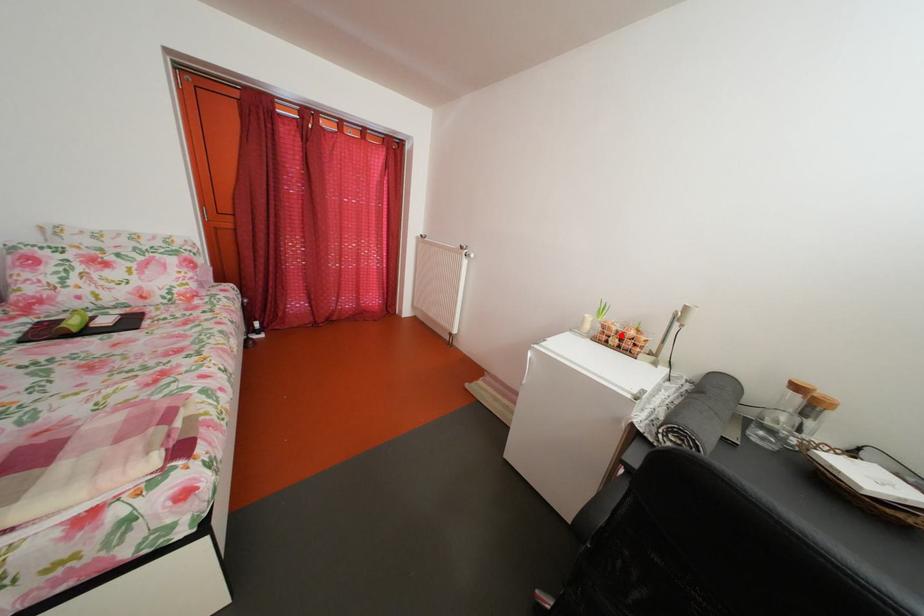
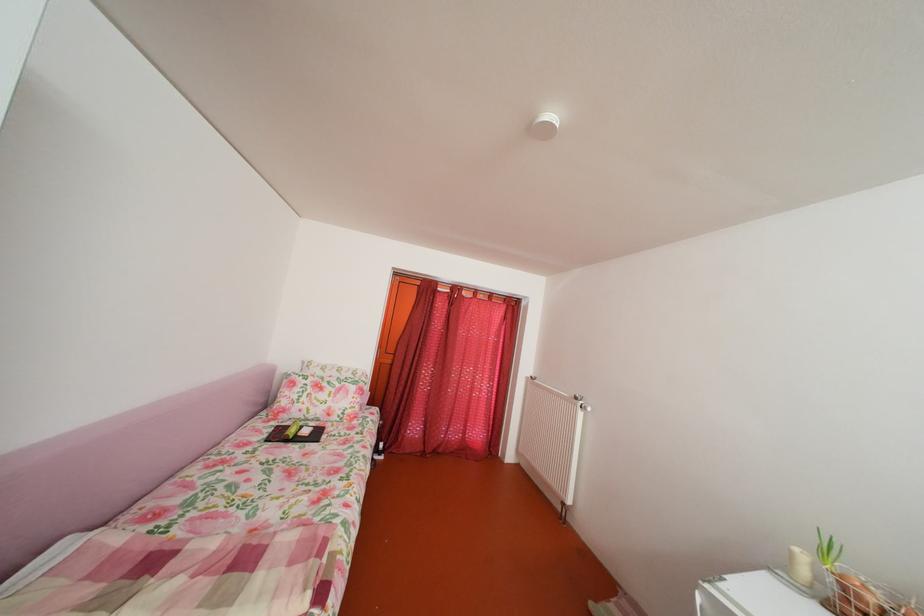
The point at the highlighted location is marked in the first image. Where is the corresponding point in the second image?

(871, 605)